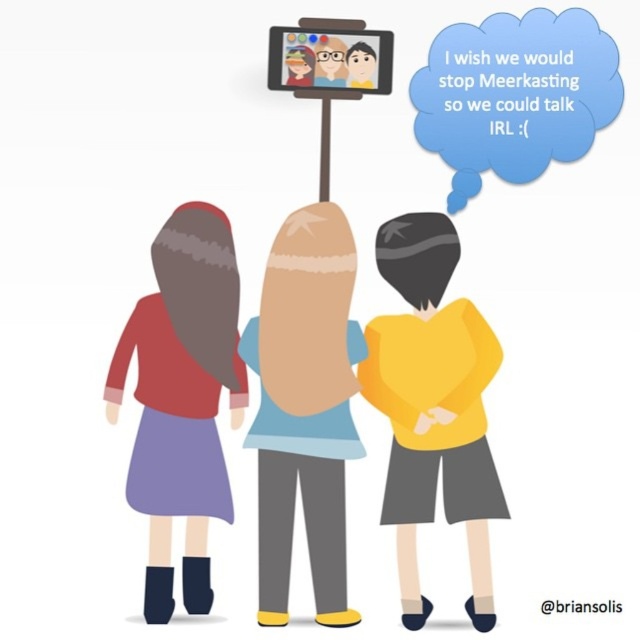
Is matte red sweater at left behind blue paper speech bubble at upper center?

No, it is in front of blue paper speech bubble at upper center.

Is matte red sweater at left to the left of blue paper speech bubble at upper center from the viewer's perspective?

Indeed, matte red sweater at left is positioned on the left side of blue paper speech bubble at upper center.

The width and height of the screenshot is (640, 640). I want to click on matte red sweater at left, so click(180, 403).

Which of these two, yellow matte shirt at center or smooth beige hair at center, stands shorter?

Standing shorter between the two is smooth beige hair at center.

Is yellow matte shirt at center in front of smooth beige hair at center?

That is False.

Between point (426, 458) and point (339, 572), which one is positioned behind?

The point (426, 458) is behind.

In order to click on yellow matte shirt at center in this screenshot , I will do `click(433, 406)`.

Looking at this image, between smooth beige hair at center and matte plastic tablet at upper center, which one is positioned higher?

Positioned higher is matte plastic tablet at upper center.

Between point (273, 304) and point (312, 54), which one is positioned in front?

Point (273, 304)

This screenshot has height=640, width=640. What are the coordinates of `smooth beige hair at center` in the screenshot? It's located at (304, 406).